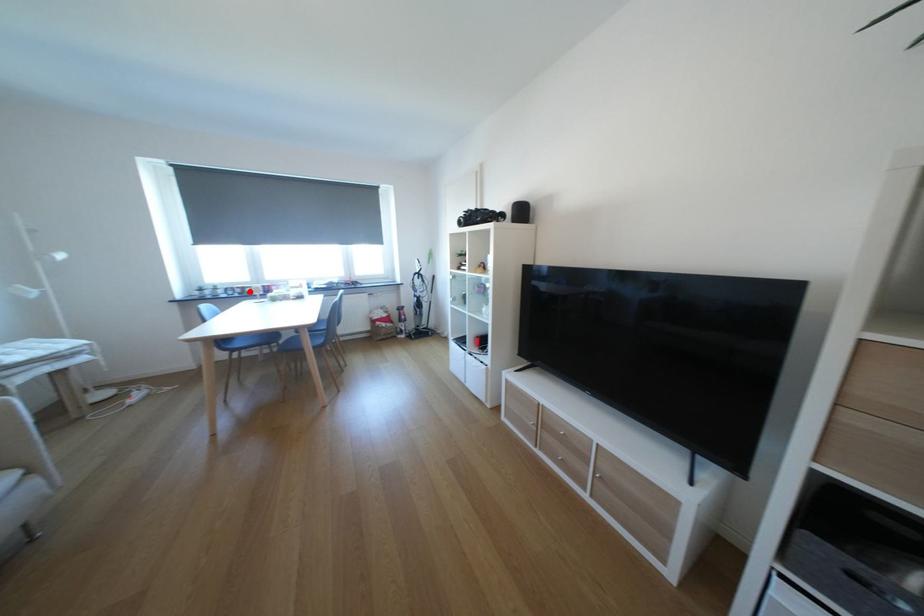
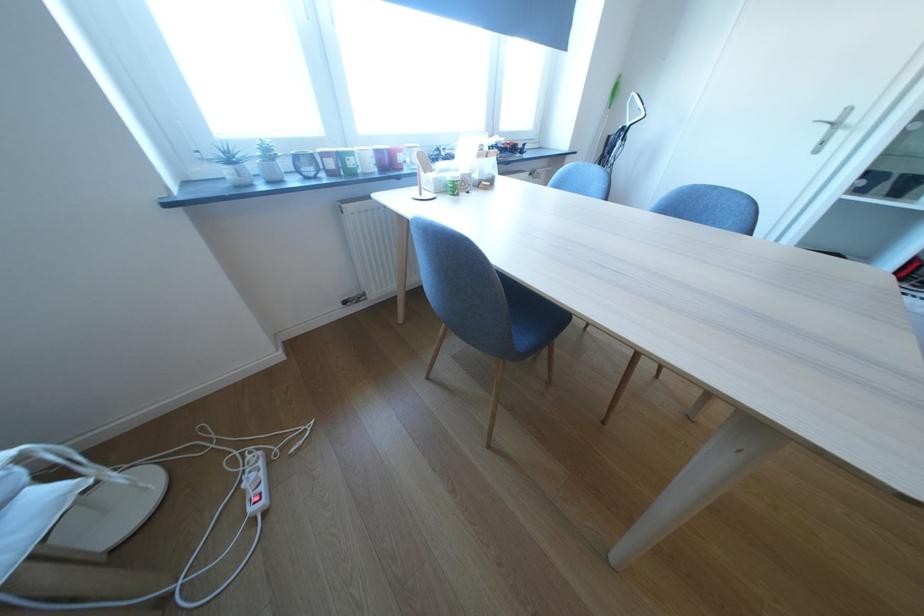
Where in the second image is the point corresponding to the highlighted location from the first image?

(342, 164)